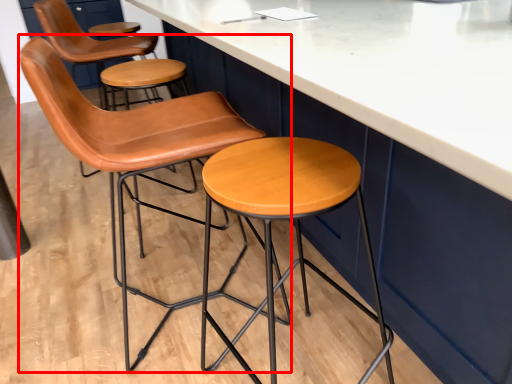
Question: Where is chair (annotated by the red box) located in relation to stool in the image?

Choices:
 (A) right
 (B) left

Answer: (B)